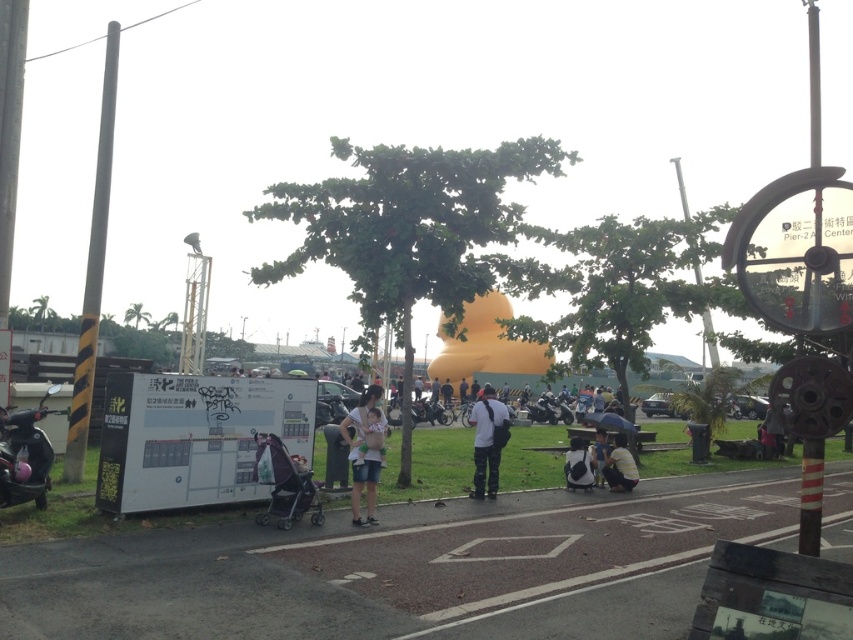
You are standing at the entrance of the park and see the white and black backpack at center. If you walk straight ahead, will you pass by the sculpture first or the signpost first?

The white and black backpack at center is located at coordinates (578, 465), which places it closer to the sculpture than the signpost. Therefore, walking straight ahead, you would pass by the sculpture first before reaching the signpost.

You are standing in the park and see a white and black backpack at center and a dark gray fabric umbrella at center. Which object is closer to you?

The white and black backpack at center is closer to you because the dark gray fabric umbrella at center is behind it.